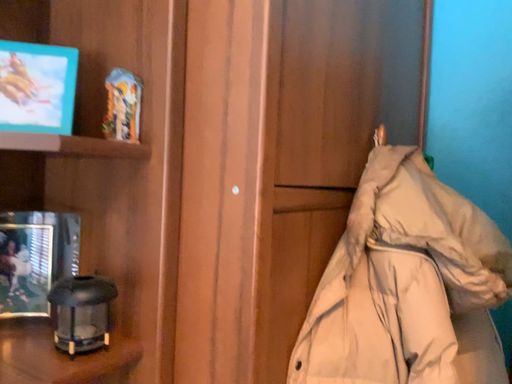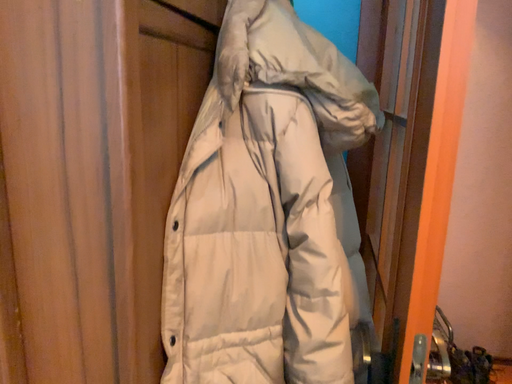
Question: How did the camera likely rotate when shooting the video?

Choices:
 (A) rotated downward
 (B) rotated upward

Answer: (A)